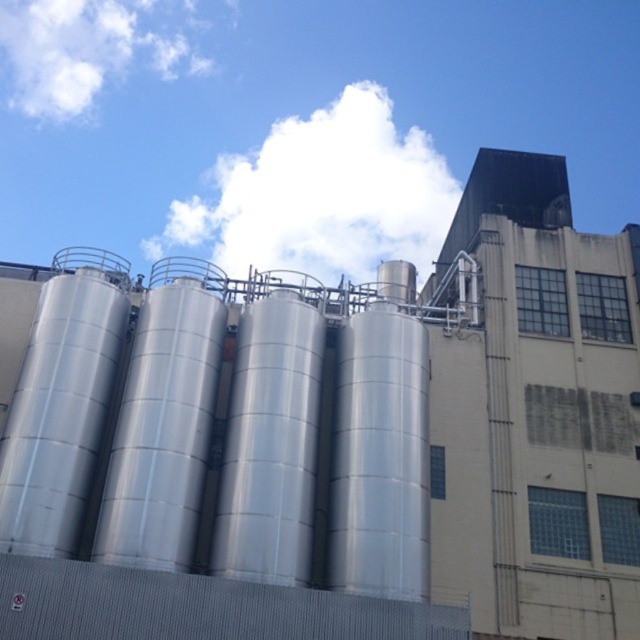
Can you confirm if white fluffy cloud at upper center is shorter than white fluffy cloud at upper left?

Yes.

Does white fluffy cloud at upper center have a greater width compared to white fluffy cloud at upper left?

No.

Is point (193, 212) farther from viewer compared to point (124, 28)?

No, (193, 212) is in front of (124, 28).

Where is `white fluffy cloud at upper center`? The image size is (640, 640). white fluffy cloud at upper center is located at coordinates (321, 195).